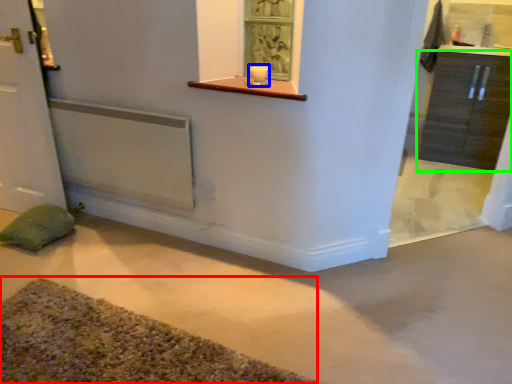
Question: Which object is the closest to the bath mat (highlighted by a red box)? Choose among these: candle holder (highlighted by a blue box) or cabinetry (highlighted by a green box).

Choices:
 (A) candle holder
 (B) cabinetry

Answer: (A)